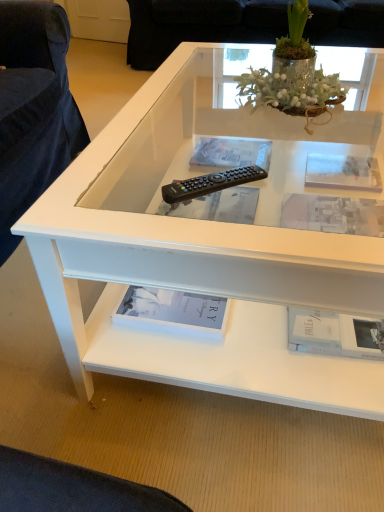
This screenshot has height=512, width=384. In order to click on empty space that is ontop of matte black remote control at center, which is the second book in back-to-front order (from a real-world perspective) in this screenshot , I will do `click(216, 201)`.